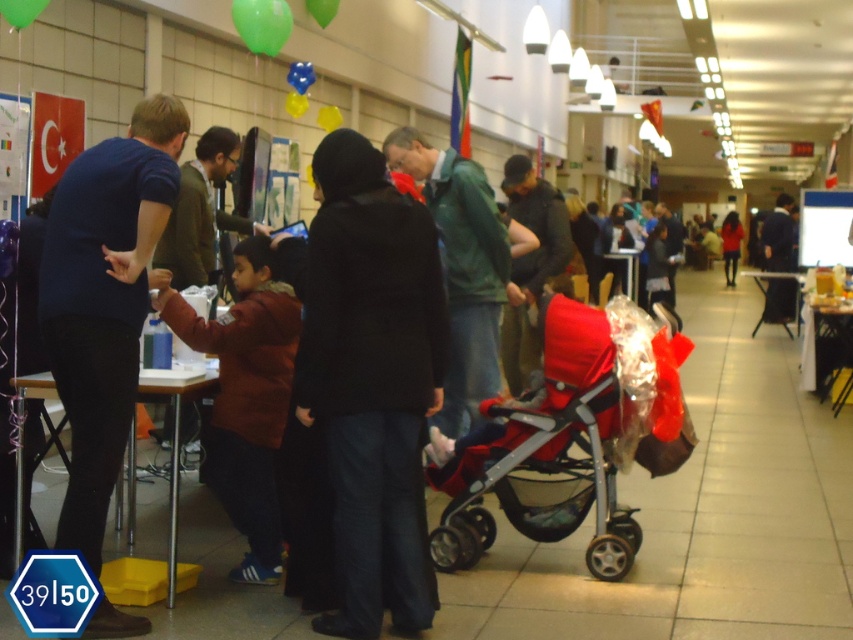
Which of these two, translucent blue balloon at upper center or green matte balloon at upper center, stands taller?

green matte balloon at upper center

Find the location of a particular element. The height and width of the screenshot is (640, 853). translucent blue balloon at upper center is located at coordinates (300, 76).

Identify the location of green matte jacket at center. The width and height of the screenshot is (853, 640). [461, 268].

Does green matte jacket at center have a greater width compared to dark brown leather jacket at center?

Indeed, green matte jacket at center has a greater width compared to dark brown leather jacket at center.

Is point (469, 182) closer to camera compared to point (508, 324)?

Yes, point (469, 182) is in front of point (508, 324).

Where is `green matte jacket at center`? The image size is (853, 640). green matte jacket at center is located at coordinates (461, 268).

Between point (96, 456) and point (772, 305), which one is positioned behind?

Positioned behind is point (772, 305).

Which is above, blue matte shirt at left or dark blue jacket at center?

dark blue jacket at center

Is point (47, 228) positioned after point (790, 316)?

No, (47, 228) is in front of (790, 316).

You are a GUI agent. You are given a task and a screenshot of the screen. Output one action in this format:
    pyautogui.click(x=<x>, y=<y>)
    Task: Click on the blue matte shirt at left
    This screenshot has width=853, height=640.
    Given the screenshot: What is the action you would take?
    pyautogui.click(x=103, y=300)